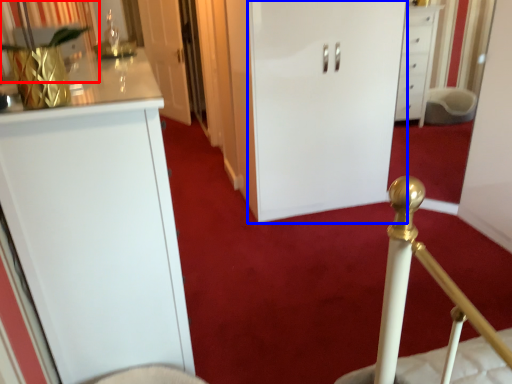
Question: Which object appears farthest to the camera in this image, curtain (highlighted by a red box) or door (highlighted by a blue box)?

Choices:
 (A) curtain
 (B) door

Answer: (B)